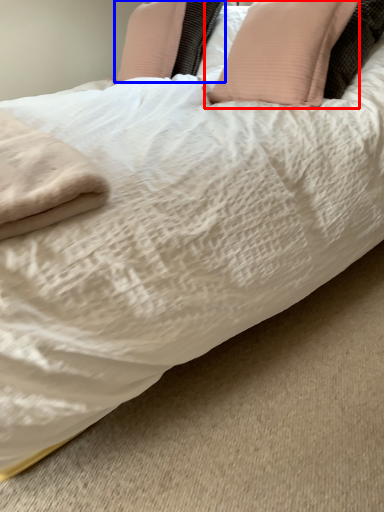
Question: Which object is further to the camera taking this photo, pillow (highlighted by a red box) or pillow (highlighted by a blue box)?

Choices:
 (A) pillow
 (B) pillow

Answer: (B)